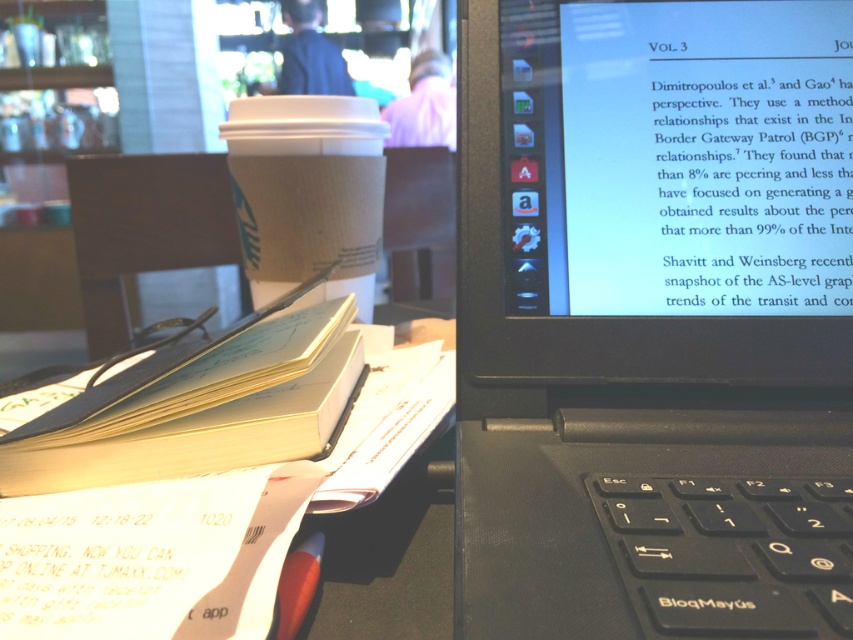
You are organizing a desk and need to place both the matte black screen at upper right and the yellow paper notebook at center. Which object requires less desk space?

The matte black screen at upper right requires less desk space because it occupies less space than the yellow paper notebook at center.

Based on the photo, you are a student trying to take notes on the laptop screen showing research about Border Gateway Patrol. You have a yellow paper notebook at center and a white cardboard cup at center on your desk. Which object is closer to you, the student?

The yellow paper notebook at center is closer to you because it is in front of the white cardboard cup at center.

You are organizing your desk and need to place both the yellow paper notebook at center and the white cardboard cup at center. Based on their current positions, which object is to the right of the other?

The yellow paper notebook at center is positioned on the right side of white cardboard cup at center.